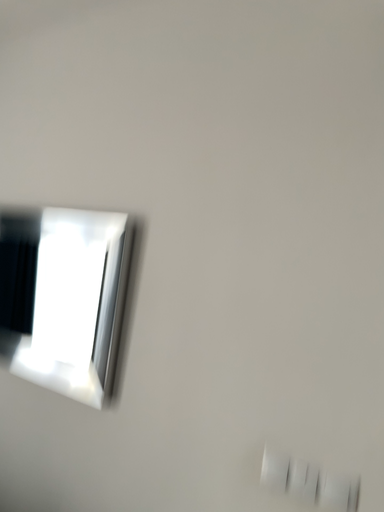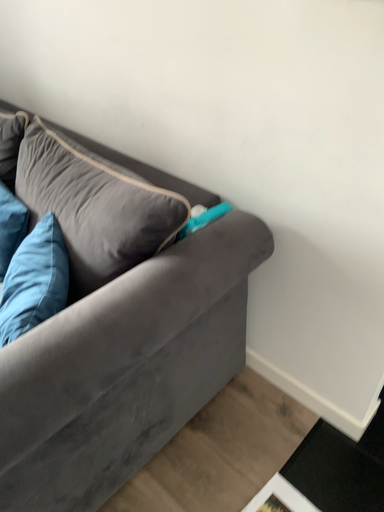
Question: Which way did the camera rotate in the video?

Choices:
 (A) rotated upward
 (B) rotated downward

Answer: (B)